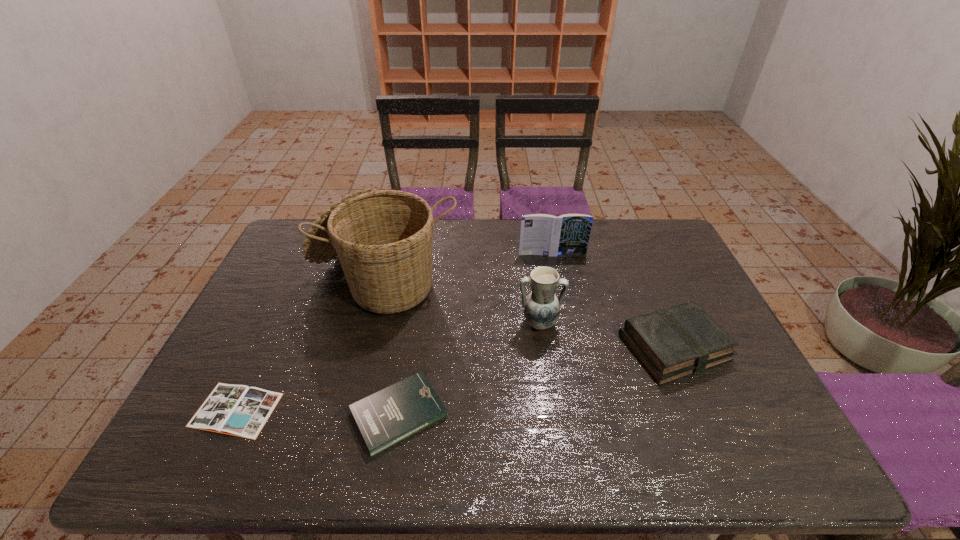
Where is `blank space located 0.060m on the right of the tallest object`? The width and height of the screenshot is (960, 540). blank space located 0.060m on the right of the tallest object is located at coordinates (478, 278).

The width and height of the screenshot is (960, 540). I want to click on vacant space located 0.240m on either side of the pottery, so pyautogui.click(x=552, y=413).

The image size is (960, 540). I want to click on vacant space located 0.120m on the front cover of the third book from left to right, so click(x=558, y=280).

Image resolution: width=960 pixels, height=540 pixels. In order to click on vacant region located on the back of the second tallest book in this screenshot , I will do `click(633, 249)`.

Identify the location of blank area located 0.120m on the back of the second book from left to right. (410, 341).

This screenshot has height=540, width=960. I want to click on free space located 0.320m on the back of the shortest book, so click(x=290, y=296).

Image resolution: width=960 pixels, height=540 pixels. What are the coordinates of `basket at the far edge` in the screenshot? It's located at (383, 238).

Where is `book at the far edge`? The image size is (960, 540). book at the far edge is located at coordinates (541, 234).

The height and width of the screenshot is (540, 960). Find the location of `basket present at the left edge`. basket present at the left edge is located at coordinates (383, 238).

The width and height of the screenshot is (960, 540). Identify the location of book present at the left edge. (238, 410).